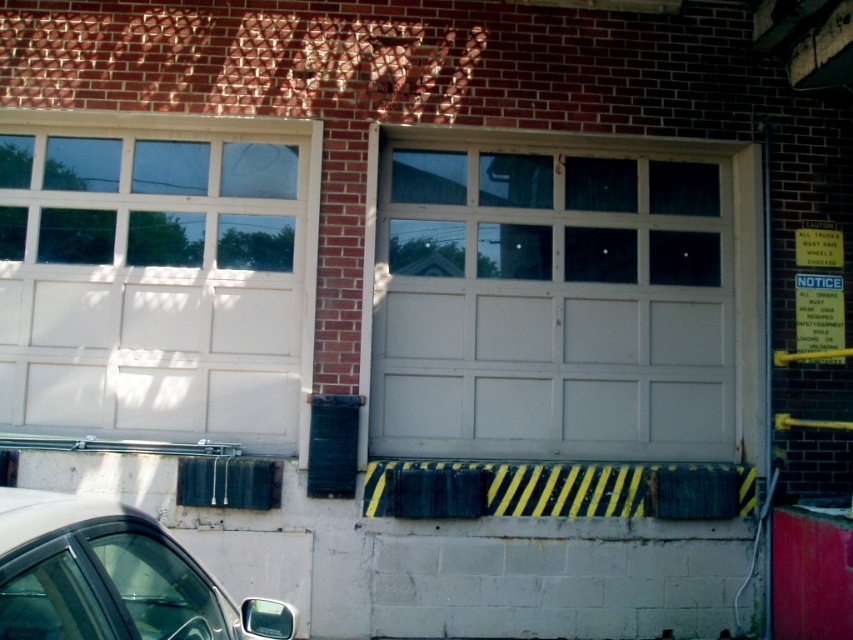
Which is in front, point (483, 253) or point (779, 609)?

Point (779, 609) is more forward.

Which is below, white painted wood door at center or metallic red barrier at lower right?

metallic red barrier at lower right is lower down.

Which is behind, point (724, 397) or point (805, 557)?

The point (724, 397) is more distant.

Find the location of `white painted wood door at center`. white painted wood door at center is located at coordinates (550, 298).

Who is lower down, white painted wood window at upper left or shiny silver car at lower left?

Answer: shiny silver car at lower left is below.

Between point (45, 397) and point (79, 508), which one is positioned in front?

Point (79, 508)

Which is behind, point (99, 285) or point (86, 541)?

Point (99, 285)

Image resolution: width=853 pixels, height=640 pixels. I want to click on white painted wood window at upper left, so click(x=157, y=275).

Is white painted wood door at center thinner than white painted wood window at upper left?

In fact, white painted wood door at center might be wider than white painted wood window at upper left.

Is white painted wood door at center smaller than white painted wood window at upper left?

No.

Identify the location of white painted wood door at center. (550, 298).

Identify the location of white painted wood door at center. Image resolution: width=853 pixels, height=640 pixels. (550, 298).